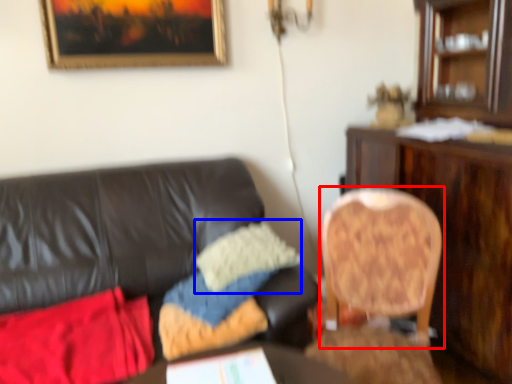
Question: Which object appears farthest to the camera in this image, chair (highlighted by a red box) or pillow (highlighted by a blue box)?

Choices:
 (A) chair
 (B) pillow

Answer: (B)